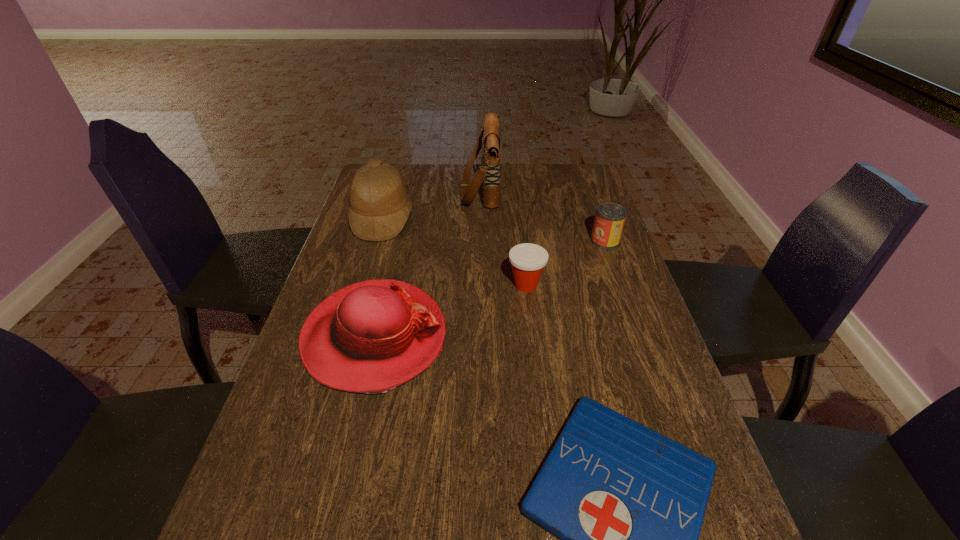
Find the location of a particular element. empty location between the shoulder bag and the nearer hat is located at coordinates (427, 263).

This screenshot has height=540, width=960. I want to click on vacant space in between the Dixie cup and the can, so click(565, 263).

Identify the location of empty location between the taller hat and the shoulder bag. The width and height of the screenshot is (960, 540). (431, 204).

Select which object appears as the fifth closest to the can. Please provide its 2D coordinates. Your answer should be formatted as a tuple, i.e. [(x, y)], where the tuple contains the x and y coordinates of a point satisfying the conditions above.

[(380, 206)]

Where is `object that ranks as the fifth closest to the taller hat`? The width and height of the screenshot is (960, 540). object that ranks as the fifth closest to the taller hat is located at coordinates (627, 503).

Locate an element on the screen. This screenshot has width=960, height=540. vacant space that satisfies the following two spatial constraints: 1. on the front-facing side of the farther hat; 2. on the back side of the Dixie cup is located at coordinates (362, 285).

You are a GUI agent. You are given a task and a screenshot of the screen. Output one action in this format:
    pyautogui.click(x=<x>, y=<y>)
    Task: Click on the vacant region that satisfies the following two spatial constraints: 1. on the front-facing side of the can; 2. on the right side of the shoulder bag
    The height and width of the screenshot is (540, 960).
    Given the screenshot: What is the action you would take?
    pyautogui.click(x=480, y=241)

The height and width of the screenshot is (540, 960). Identify the location of free region that satisfies the following two spatial constraints: 1. on the front-facing side of the shoulder bag; 2. on the right side of the can. (480, 241).

Find the location of `free location that satisfies the following two spatial constraints: 1. on the front-facing side of the shoulder bag; 2. on the back side of the can`. free location that satisfies the following two spatial constraints: 1. on the front-facing side of the shoulder bag; 2. on the back side of the can is located at coordinates (480, 241).

Locate an element on the screen. The width and height of the screenshot is (960, 540). free space that satisfies the following two spatial constraints: 1. on the front-facing side of the can; 2. on the left side of the farther hat is located at coordinates (375, 241).